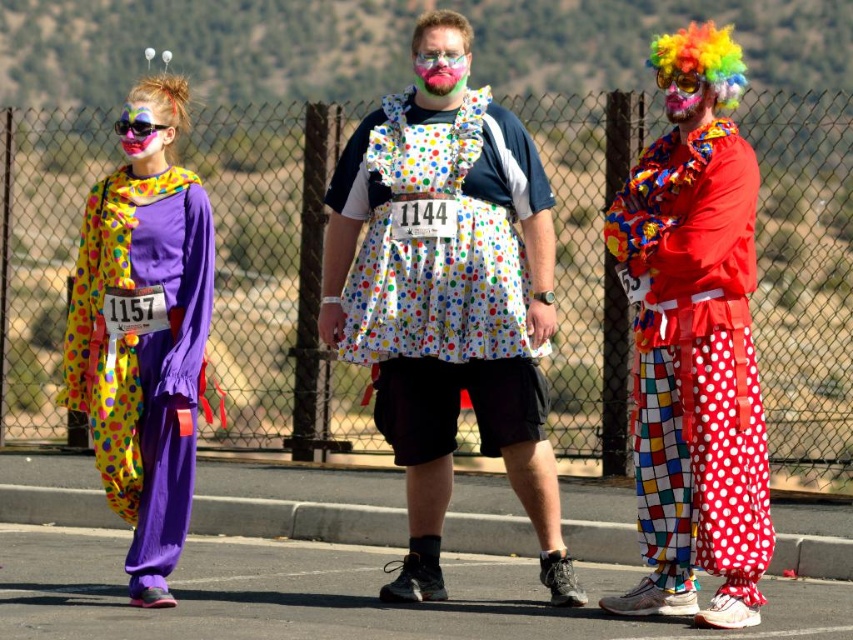
You are a photographer trying to capture a clear shot of the multicolored plastic goggles at center and the polka dot fabric clown pants at right. Which object should you focus on first to ensure it appears sharp in the photo?

The polka dot fabric clown pants at right is in front of the multicolored plastic goggles at center, so you should focus on the polka dot fabric clown pants at right first to ensure it appears sharp in the photo.

Based on the photo, you are a photographer trying to capture a closeup shot of the pink matte goggles at center and the matte black sunglasses at upper left. Which object should you focus on first if you want to ensure both are in focus without adjusting the camera settings?

The matte black sunglasses at upper left should be focused on first because it is closer to the camera than the pink matte goggles at center, so focusing on the closer object first allows both to be in focus with proper depth of field.

You are a photographer trying to capture a closeup shot of the multicolored plastic goggles at center while also including the polka dot fabric clown pants at right in the frame. Given that your camera has a maximum focus range of 5 feet, will you be able to capture both objects in focus?

The polka dot fabric clown pants at right is 5.71 feet away from the multicolored plastic goggles at center. Since the distance between them exceeds the camera maximum focus range of 5 feet, you won t be able to capture both objects in focus.